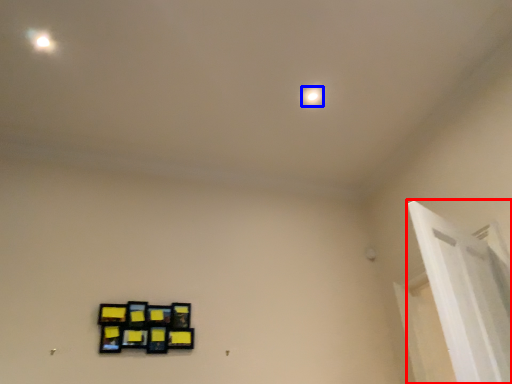
Question: Which of the following is the farthest to the observer, window frame (highlighted by a red box) or dot (highlighted by a blue box)?

Choices:
 (A) window frame
 (B) dot

Answer: (B)